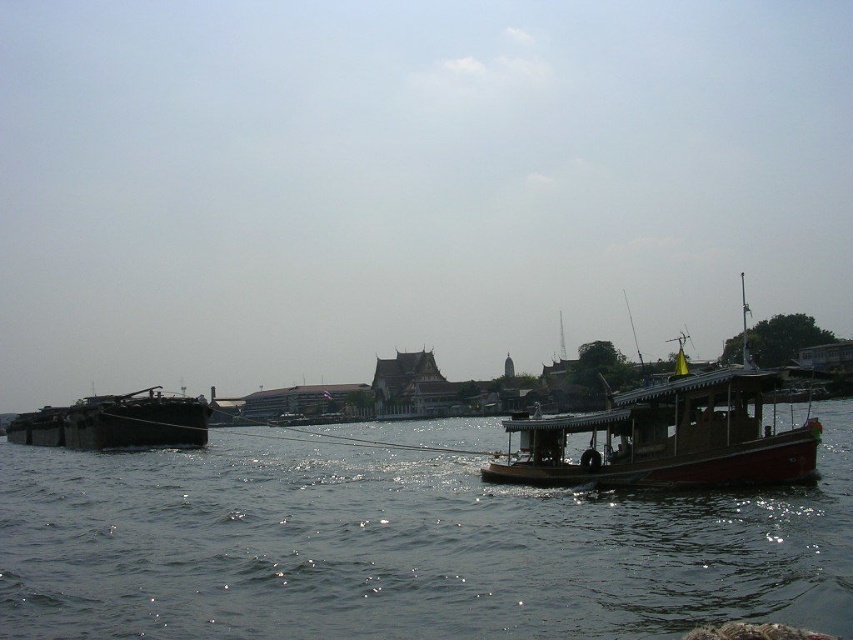
I want to click on wooden boat at center, so click(x=666, y=436).

Between wooden boat at center and dark brown wooden barge at left, which one appears on the left side from the viewer's perspective?

Positioned to the left is dark brown wooden barge at left.

Locate an element on the screen. wooden boat at center is located at coordinates (x=666, y=436).

Between smooth water at center and dark brown wooden barge at left, which one is positioned lower?

dark brown wooden barge at left is below.

Is smooth water at center to the left of dark brown wooden barge at left from the viewer's perspective?

Incorrect, smooth water at center is not on the left side of dark brown wooden barge at left.

Between point (663, 556) and point (202, 401), which one is positioned behind?

The point (202, 401) is behind.

Find the location of a particular element. The height and width of the screenshot is (640, 853). smooth water at center is located at coordinates (399, 547).

This screenshot has height=640, width=853. What do you see at coordinates (399, 547) in the screenshot? I see `smooth water at center` at bounding box center [399, 547].

Is smooth water at center smaller than wooden boat at center?

Yes.

The height and width of the screenshot is (640, 853). In order to click on smooth water at center in this screenshot , I will do `click(399, 547)`.

Where is `smooth water at center`? This screenshot has width=853, height=640. smooth water at center is located at coordinates (399, 547).